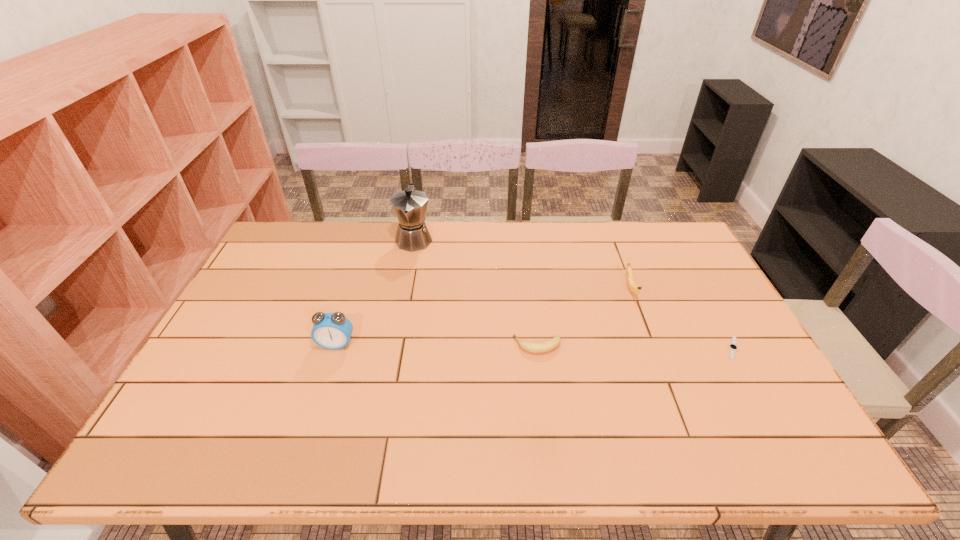
In the image, there is a desktop. Where is `vacant space at the near edge`? The width and height of the screenshot is (960, 540). vacant space at the near edge is located at coordinates (612, 449).

Identify the location of vacant space at the left edge of the desktop. (237, 401).

Find the location of a particular element. This screenshot has width=960, height=540. free spot at the right edge of the desktop is located at coordinates (665, 274).

Locate an element on the screen. The width and height of the screenshot is (960, 540). free space at the far left corner of the desktop is located at coordinates (x=314, y=247).

The image size is (960, 540). I want to click on vacant position at the near left corner of the desktop, so click(203, 454).

In the image, there is a desktop. At what (x,y) coordinates should I click in order to perform the action: click on vacant region at the far right corner. Please return your answer as a coordinate pair (x, y). The image size is (960, 540). Looking at the image, I should click on (651, 242).

At what (x,y) coordinates should I click in order to perform the action: click on unoccupied area between the third object from right to left and the watch. Please return your answer as a coordinate pair (x, y). The image size is (960, 540). Looking at the image, I should click on (636, 347).

Where is `free space between the rightmost object and the third shortest object`? This screenshot has width=960, height=540. free space between the rightmost object and the third shortest object is located at coordinates (682, 319).

The image size is (960, 540). Identify the location of vacant space in between the leftmost object and the fourth object from left to right. (484, 316).

Identify the location of empty space that is in between the third tallest object and the fourth shortest object. This screenshot has width=960, height=540. (484, 316).